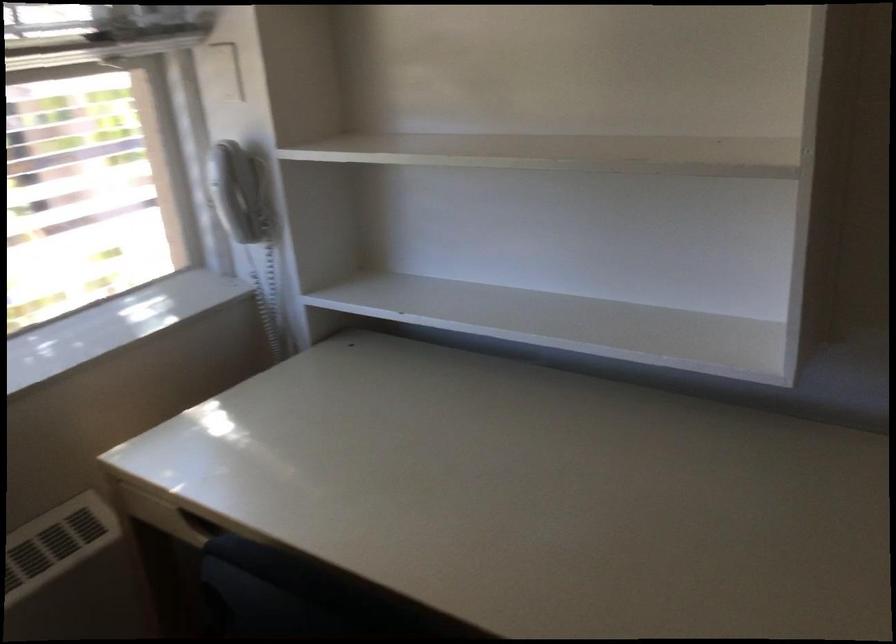
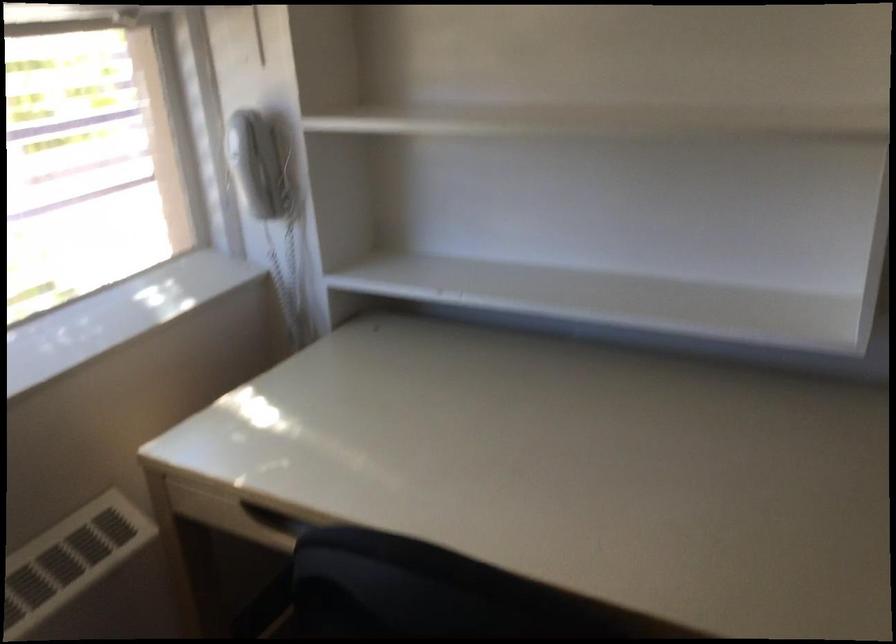
Question: Which direction would the cameraman need to move to produce the second image? Reply with the corresponding letter.

Choices:
 (A) Left
 (B) Right
 (C) Forward
 (D) Backward

Answer: (A)